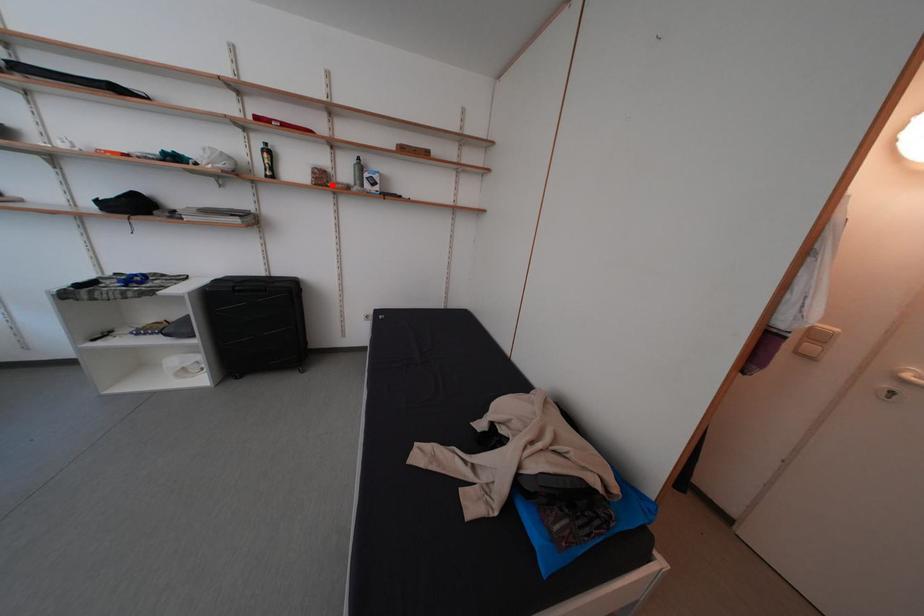
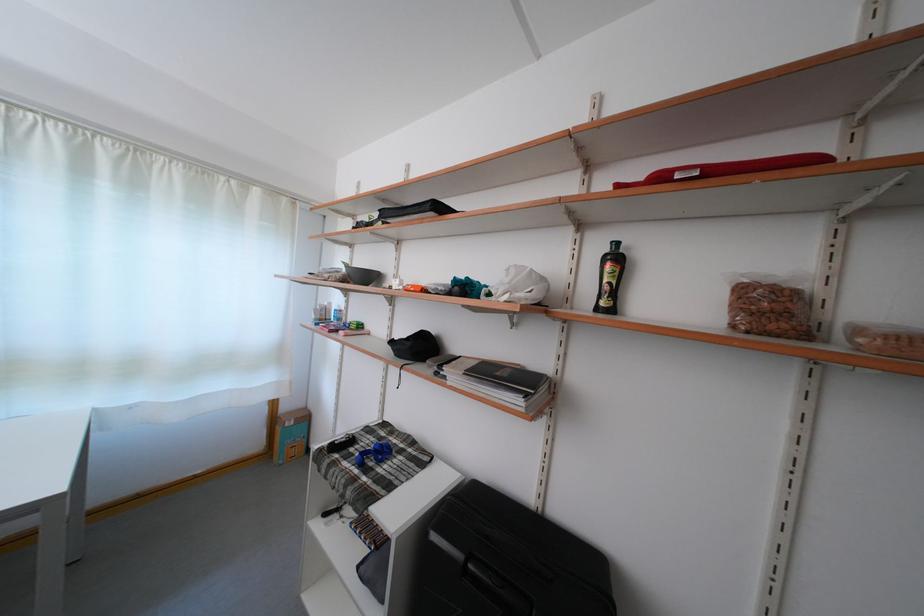
In the second image, find the point that corresponds to the highlighted location in the first image.

(782, 321)